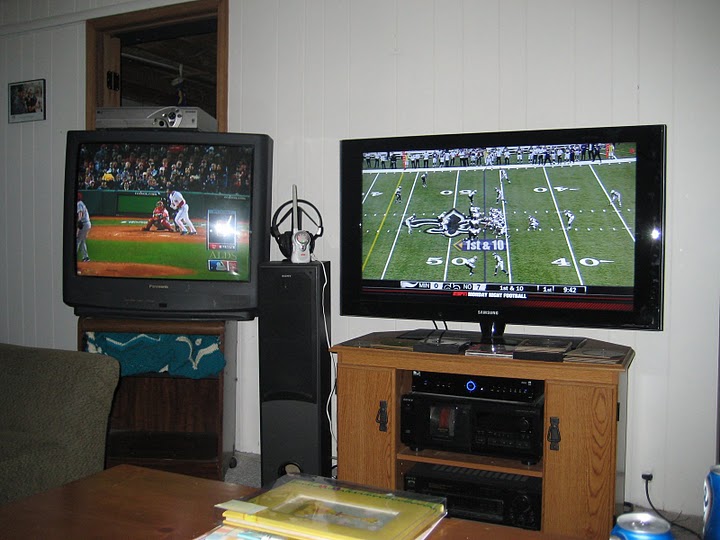
Where is `handles`? handles is located at coordinates (556, 433), (381, 421).